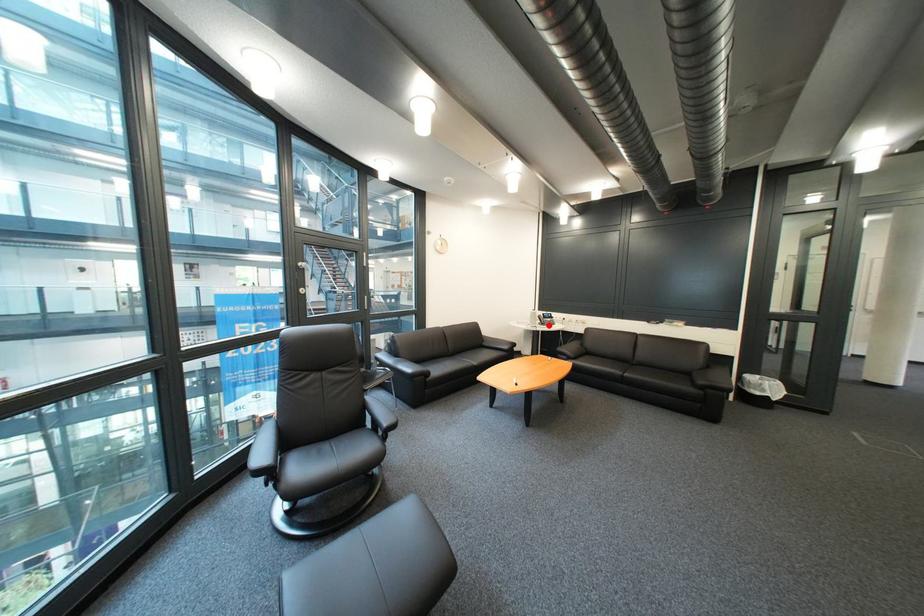
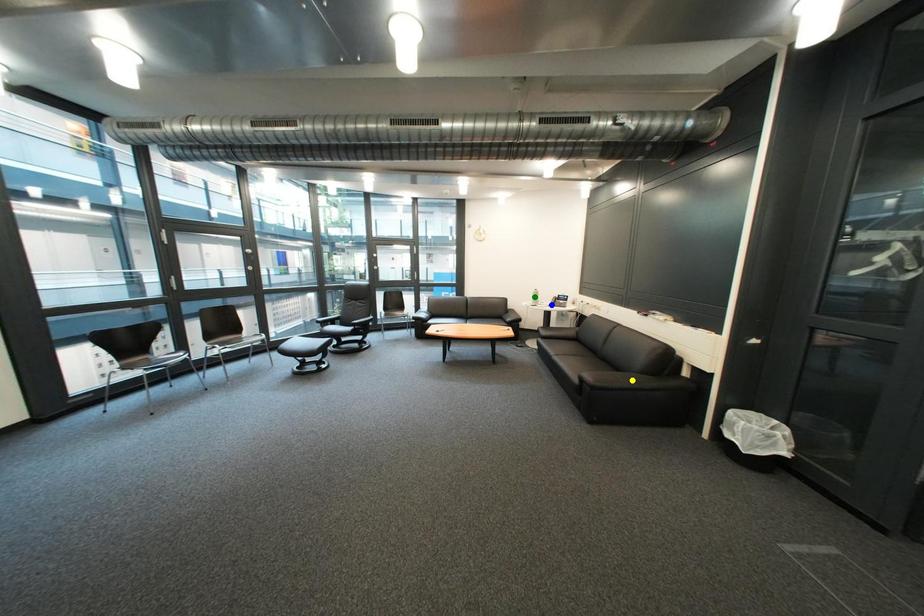
Question: I am providing you with two images of the same scene from different viewpoints. A red point is marked on the first image. You are given multiple points on the second image. Can you choose the point in image 2 that corresponds to the point in image 1?

Choices:
 (A) yellow point
 (B) blue point
 (C) green point

Answer: (B)